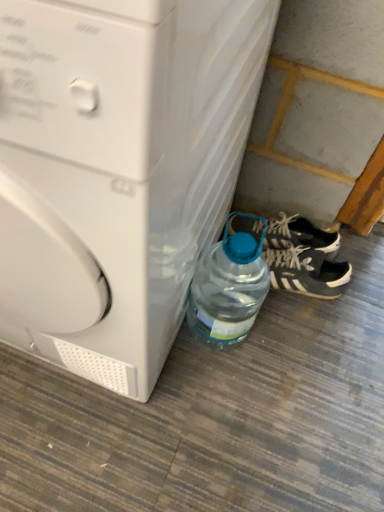
Question: Do you think black suede sneakers at lower right is within black matte sneakers at lower right, or outside of it?

Choices:
 (A) outside
 (B) inside

Answer: (A)

Question: Based on their sizes in the image, would you say black suede sneakers at lower right is bigger or smaller than black matte sneakers at lower right?

Choices:
 (A) big
 (B) small

Answer: (A)

Question: Which is farther from the black matte sneakers at lower right?

Choices:
 (A) black suede sneakers at lower right
 (B) transparent plastic bottle at lower right
 (C) white plastic washing machine at lower left

Answer: (C)

Question: Which object is positioned closest to the white plastic washing machine at lower left?

Choices:
 (A) black suede sneakers at lower right
 (B) transparent plastic bottle at lower right
 (C) black matte sneakers at lower right

Answer: (B)